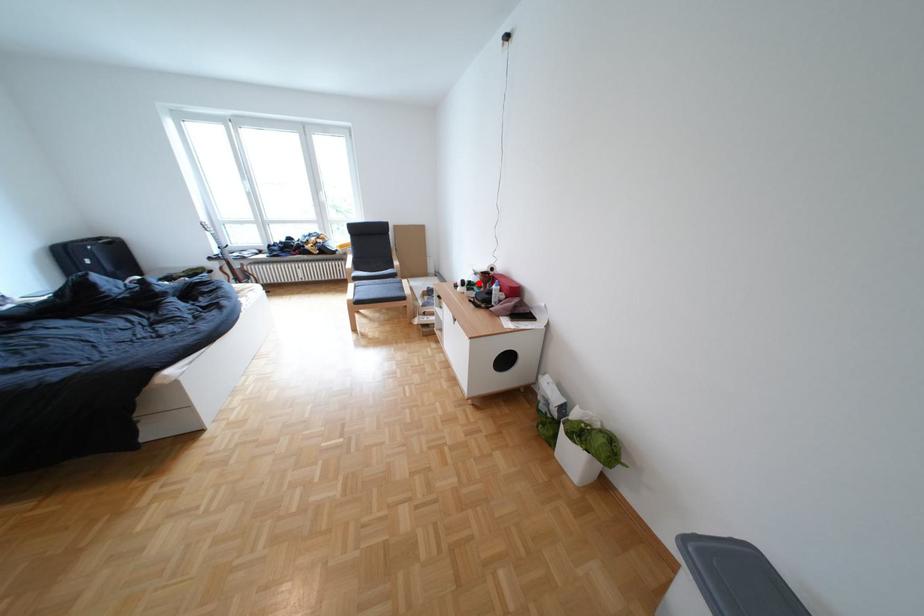
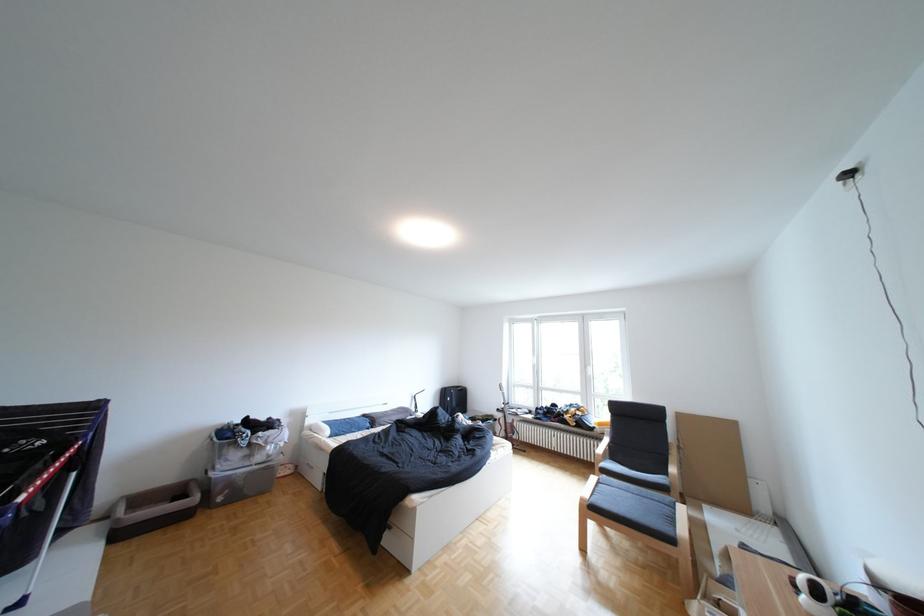
The point at the highlighted location is marked in the first image. Where is the corresponding point in the second image?

(832, 591)